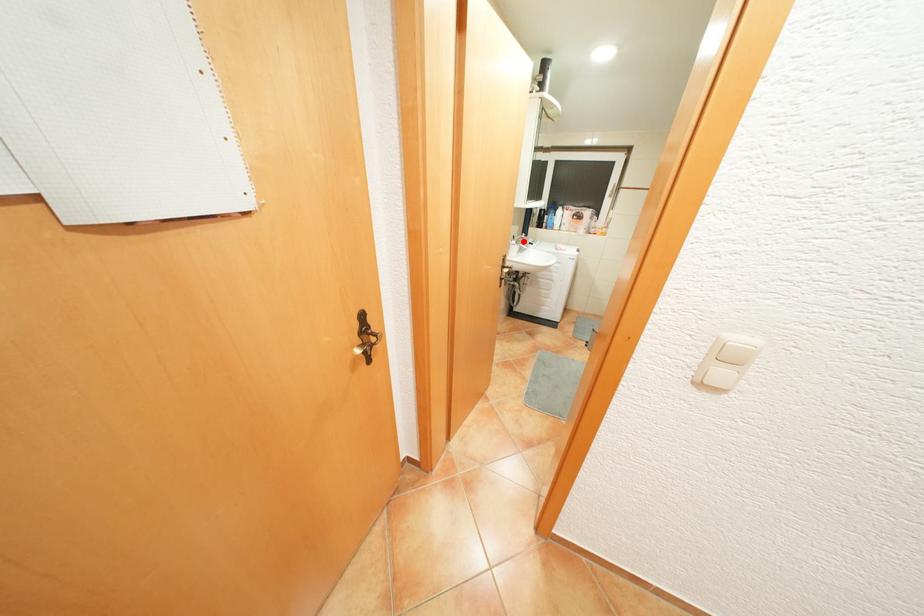
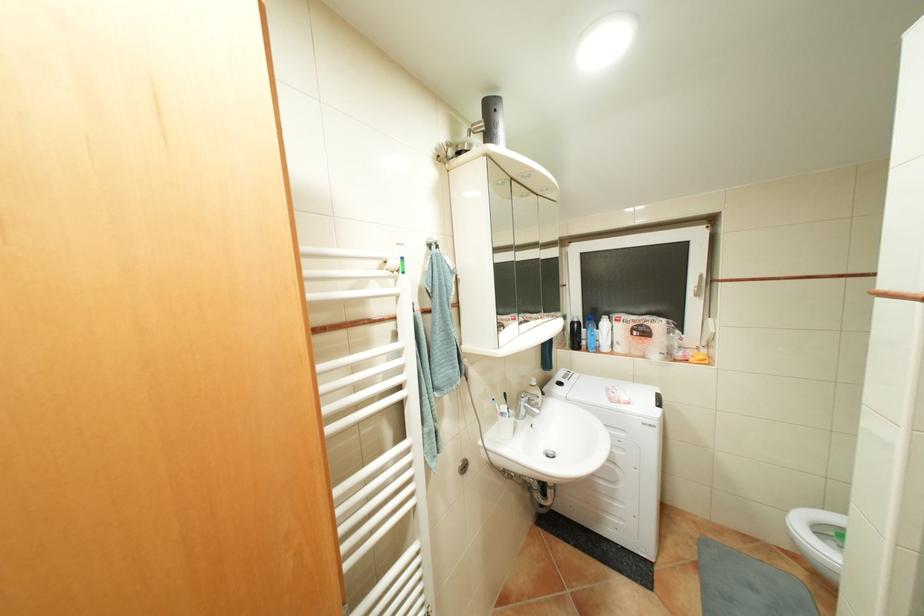
Question: I am providing you with two images of the same scene from different viewpoints. Image1 has a red point marked. In image2, the corresponding 3D location appears at what relative position? Reply with the corresponding letter.

Choices:
 (A) Closer
 (B) Farther

Answer: (B)